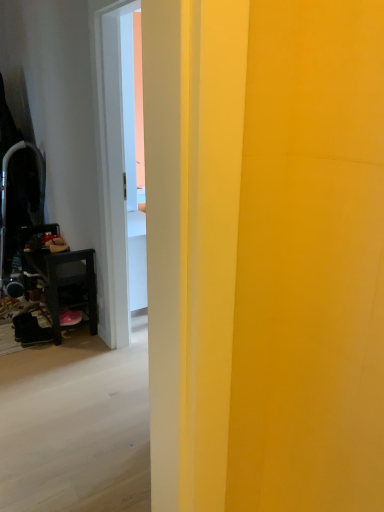
Find the location of a particular element. vacant region to the right of black suede boot at lower left, the 1th footwear from the left is located at coordinates coord(64,347).